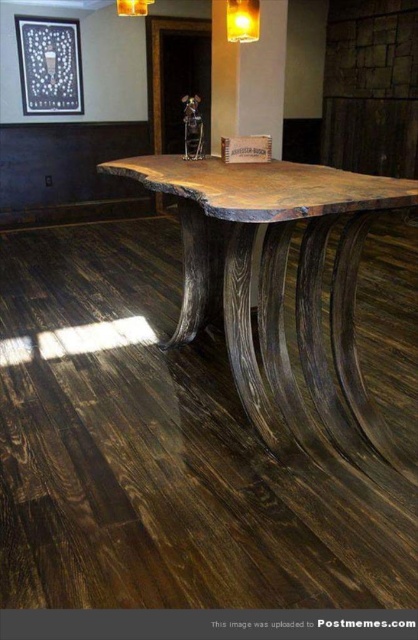
Question: Can you confirm if dark wood table at center is positioned to the left of matte gold lampshade at upper center?

Choices:
 (A) no
 (B) yes

Answer: (A)

Question: Based on their relative distances, which object is nearer to the matte yellow glass at upper center?

Choices:
 (A) matte gold lampshade at upper center
 (B) dark wood table at center

Answer: (A)

Question: Considering the real-world distances, which object is farthest from the matte yellow glass at upper center?

Choices:
 (A) matte gold lampshade at upper center
 (B) dark wood table at center

Answer: (B)

Question: Based on their relative distances, which object is farther from the matte gold lampshade at upper center?

Choices:
 (A) dark wood table at center
 (B) matte yellow glass at upper center

Answer: (A)

Question: Is matte yellow glass at upper center positioned before matte gold lampshade at upper center?

Choices:
 (A) no
 (B) yes

Answer: (B)

Question: Observing the image, what is the correct spatial positioning of dark wood table at center in reference to matte gold lampshade at upper center?

Choices:
 (A) left
 (B) right

Answer: (B)